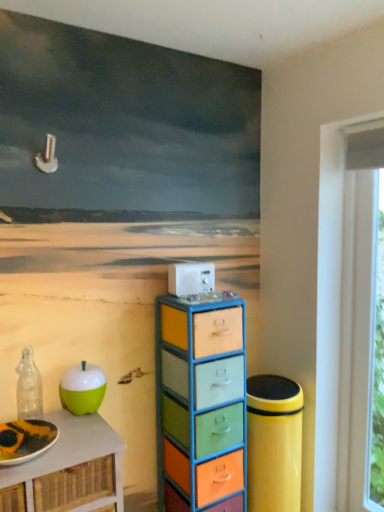
Image resolution: width=384 pixels, height=512 pixels. Find the location of `free spot to the right of transparent glass bottle at left`. free spot to the right of transparent glass bottle at left is located at coordinates (67, 426).